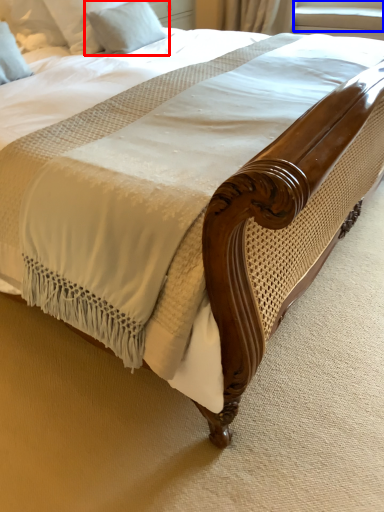
Question: Which object appears closest to the camera in this image, pillow (highlighted by a red box) or window screen (highlighted by a blue box)?

Choices:
 (A) pillow
 (B) window screen

Answer: (A)